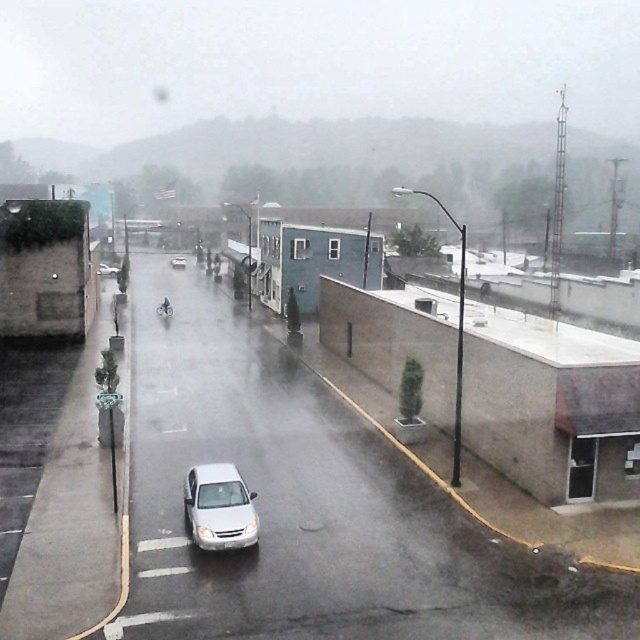
Is white matte sedan at center bigger than white matte car at center?

Indeed, white matte sedan at center has a larger size compared to white matte car at center.

Between point (104, 273) and point (182, 266), which one is positioned behind?

Point (182, 266)

Is point (104, 273) behind point (177, 262)?

No.

Image resolution: width=640 pixels, height=640 pixels. Identify the location of white matte sedan at center. (108, 269).

Which is more to the right, white glossy sedan at center or white matte sedan at center?

Positioned to the right is white glossy sedan at center.

Is white glossy sedan at center bigger than white matte sedan at center?

Actually, white glossy sedan at center might be smaller than white matte sedan at center.

Locate an element on the screen. The image size is (640, 640). white glossy sedan at center is located at coordinates (218, 508).

In order to click on white glossy sedan at center in this screenshot , I will do `click(218, 508)`.

Based on the photo, can you confirm if white glossy sedan at center is positioned below white matte car at center?

Yes, white glossy sedan at center is below white matte car at center.

Does white glossy sedan at center have a greater width compared to white matte car at center?

Incorrect, white glossy sedan at center's width does not surpass white matte car at center's.

Does point (196, 532) lie behind point (180, 256)?

That is False.

I want to click on white glossy sedan at center, so click(x=218, y=508).